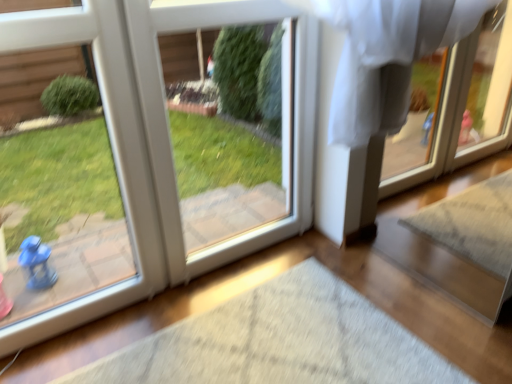
Locate an element on the screen. This screenshot has height=384, width=512. white plastic screen door at center is located at coordinates (294, 163).

The height and width of the screenshot is (384, 512). What do you see at coordinates (294, 163) in the screenshot? I see `white plastic screen door at center` at bounding box center [294, 163].

Image resolution: width=512 pixels, height=384 pixels. What do you see at coordinates (113, 152) in the screenshot?
I see `white glossy door at left` at bounding box center [113, 152].

Identify the location of white glossy door at left. (113, 152).

In order to face white glossy door at left, should I rotate leftwards or rightwards?

Rotate left and turn 25.335 degrees.

Identify the location of white plastic screen door at center. (294, 163).

Which object is positioned more to the left, white glossy door at left or white plastic screen door at center?

white glossy door at left.

Considering the relative positions of white glossy door at left and white plastic screen door at center in the image provided, is white glossy door at left behind white plastic screen door at center?

No.

Which is more distant, (x=149, y=284) or (x=267, y=230)?

Point (x=267, y=230)

From the image's perspective, relative to white plastic screen door at center, is white glossy door at left above or below?

white glossy door at left is situated lower than white plastic screen door at center in the image.

From a real-world perspective, is white glossy door at left located beneath white plastic screen door at center?

No, from a real-world perspective, white glossy door at left is not below white plastic screen door at center.

In terms of width, does white glossy door at left look wider or thinner when compared to white plastic screen door at center?

white glossy door at left is thinner than white plastic screen door at center.

Does white glossy door at left have a lesser height compared to white plastic screen door at center?

In fact, white glossy door at left may be taller than white plastic screen door at center.

Between white glossy door at left and white plastic screen door at center, which one has larger size?

white plastic screen door at center.

Which is correct: white glossy door at left is inside white plastic screen door at center, or outside of it?

white glossy door at left exists outside the volume of white plastic screen door at center.

Is white glossy door at left not close to white plastic screen door at center?

No, white glossy door at left is not far from white plastic screen door at center.

From the picture: Is white glossy door at left facing away from white plastic screen door at center?

white glossy door at left does not have its back to white plastic screen door at center.

How many degrees apart are the facing directions of white glossy door at left and white plastic screen door at center?

white glossy door at left and white plastic screen door at center are facing 0.000766 degrees away from each other.

You are a GUI agent. You are given a task and a screenshot of the screen. Output one action in this format:
    pyautogui.click(x=<x>, y=<y>)
    Task: Click on the door that is below the white plastic screen door at center (from the image's perspective)
    The width and height of the screenshot is (512, 384).
    Given the screenshot: What is the action you would take?
    pyautogui.click(x=113, y=152)

Is white plastic screen door at center at the right side of white glossy door at left?

Correct, you'll find white plastic screen door at center to the right of white glossy door at left.

Is white plastic screen door at center behind white glossy door at left?

Yes.

Considering the positions of point (151, 6) and point (106, 99), is point (151, 6) closer or farther from the camera than point (106, 99)?

Point (151, 6) is positioned farther from the camera compared to point (106, 99).

From the image's perspective, is white plastic screen door at center located above white glossy door at left?

Indeed, from the image's perspective, white plastic screen door at center is shown above white glossy door at left.

Consider the image. From a real-world perspective, which is physically below, white plastic screen door at center or white glossy door at left?

In real-world perspective, white plastic screen door at center is lower.

Considering the sizes of objects white plastic screen door at center and white glossy door at left in the image provided, who is thinner, white plastic screen door at center or white glossy door at left?

With smaller width is white glossy door at left.

Which of these two, white plastic screen door at center or white glossy door at left, stands taller?

With more height is white glossy door at left.

Does white plastic screen door at center have a smaller size compared to white glossy door at left?

No, white plastic screen door at center is not smaller than white glossy door at left.

Is white glossy door at left surrounded by white plastic screen door at center?

Definitely not — white glossy door at left is not inside white plastic screen door at center.

Are white plastic screen door at center and white glossy door at left far apart?

No.

Could you tell me if white plastic screen door at center is turned towards white glossy door at left?

No, white plastic screen door at center does not turn towards white glossy door at left.

I want to click on door above the white plastic screen door at center (from a real-world perspective), so click(113, 152).

Locate an element on the screen. The image size is (512, 384). screen door that appears below the white glossy door at left (from a real-world perspective) is located at coordinates (294, 163).

You are a GUI agent. You are given a task and a screenshot of the screen. Output one action in this format:
    pyautogui.click(x=<x>, y=<y>)
    Task: Click on the door in front of the white plastic screen door at center
    The width and height of the screenshot is (512, 384).
    Given the screenshot: What is the action you would take?
    pyautogui.click(x=113, y=152)